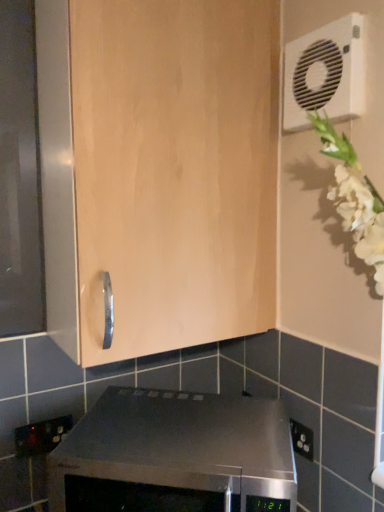
Question: From the image's perspective, would you say light wood cabinet at center is shown under black plastic electric outlet at lower left?

Choices:
 (A) no
 (B) yes

Answer: (A)

Question: Does light wood cabinet at center lie behind black plastic electric outlet at lower left?

Choices:
 (A) yes
 (B) no

Answer: (B)

Question: Can you confirm if light wood cabinet at center is wider than black plastic electric outlet at lower left?

Choices:
 (A) no
 (B) yes

Answer: (B)

Question: From a real-world perspective, is light wood cabinet at center physically below black plastic electric outlet at lower left?

Choices:
 (A) yes
 (B) no

Answer: (B)

Question: Is light wood cabinet at center directly adjacent to black plastic electric outlet at lower left?

Choices:
 (A) yes
 (B) no

Answer: (B)

Question: Does light wood cabinet at center have a smaller size compared to black plastic electric outlet at lower left?

Choices:
 (A) no
 (B) yes

Answer: (A)

Question: From a real-world perspective, does light wood cabinet at center sit lower than satin black oven at lower center?

Choices:
 (A) yes
 (B) no

Answer: (B)

Question: From a real-world perspective, is light wood cabinet at center located higher than satin black oven at lower center?

Choices:
 (A) yes
 (B) no

Answer: (A)

Question: Does light wood cabinet at center have a greater width compared to satin black oven at lower center?

Choices:
 (A) yes
 (B) no

Answer: (B)

Question: Is light wood cabinet at center positioned before satin black oven at lower center?

Choices:
 (A) no
 (B) yes

Answer: (A)

Question: Is light wood cabinet at center behind satin black oven at lower center?

Choices:
 (A) yes
 (B) no

Answer: (A)

Question: Does light wood cabinet at center have a lesser width compared to satin black oven at lower center?

Choices:
 (A) yes
 (B) no

Answer: (A)

Question: Is black plastic electric outlet at lower left positioned in front of white plastic air conditioning unit at upper right?

Choices:
 (A) no
 (B) yes

Answer: (A)